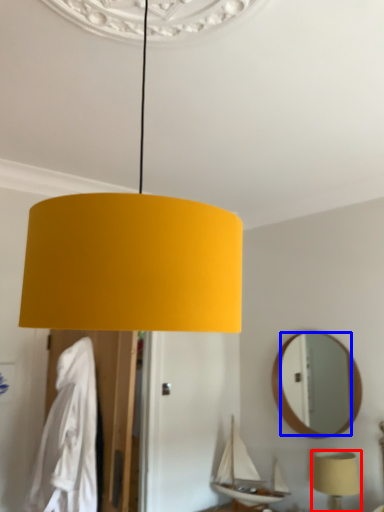
Question: Which object is closer to the camera taking this photo, lamp (highlighted by a red box) or mirror (highlighted by a blue box)?

Choices:
 (A) lamp
 (B) mirror

Answer: (A)